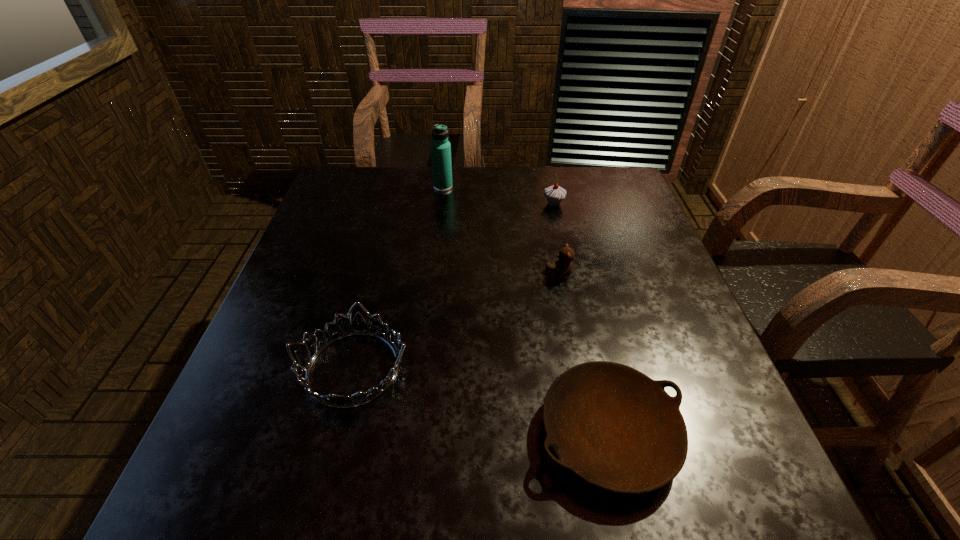
You are a GUI agent. You are given a task and a screenshot of the screen. Output one action in this format:
    pyautogui.click(x=<x>, y=<y>)
    Task: Click on the empty location between the cupcake and the thermos bottle
    The width and height of the screenshot is (960, 540).
    Given the screenshot: What is the action you would take?
    pyautogui.click(x=498, y=195)

Where is `unoccupied position between the plate and the fourth shortest object`? The width and height of the screenshot is (960, 540). unoccupied position between the plate and the fourth shortest object is located at coordinates (582, 319).

This screenshot has height=540, width=960. I want to click on free spot between the cupcake and the third farthest object, so click(557, 239).

The width and height of the screenshot is (960, 540). In order to click on free space between the tiara and the thermos bottle in this screenshot , I will do `click(398, 278)`.

The width and height of the screenshot is (960, 540). In order to click on free spot between the tiara and the shortest object in this screenshot , I will do `click(481, 401)`.

This screenshot has height=540, width=960. I want to click on empty space that is in between the shortest object and the fourth shortest object, so (582, 319).

Find the location of a particular element. This screenshot has width=960, height=540. the fourth closest object to the teddy bear is located at coordinates (440, 147).

Identify which object is the third nearest to the thermos bottle. Please provide its 2D coordinates. Your answer should be formatted as a tuple, i.e. [(x, y)], where the tuple contains the x and y coordinates of a point satisfying the conditions above.

[(359, 326)]

In order to click on free space in the image that satisfies the following two spatial constraints: 1. on the front side of the second farthest object; 2. on the face of the third nearest object in this screenshot , I will do `click(569, 275)`.

Identify the location of vacant point that satisfies the following two spatial constraints: 1. on the front side of the tallest object; 2. on the left side of the plate. The image size is (960, 540). (415, 434).